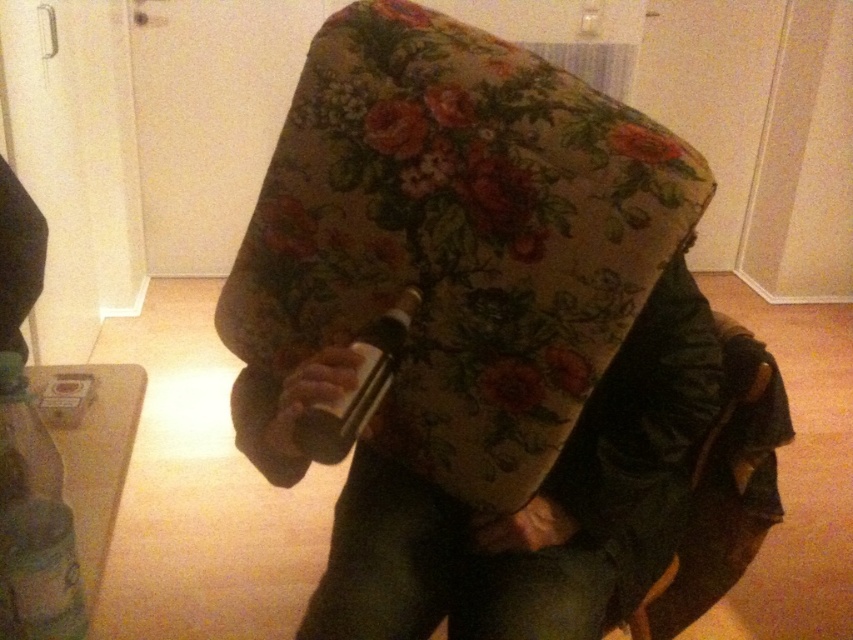
Is floral fabric armchair at center closer to camera compared to translucent plastic bottle at lower left?

No, floral fabric armchair at center is further to the viewer.

Can you confirm if floral fabric armchair at center is bigger than translucent plastic bottle at lower left?

Yes, floral fabric armchair at center is bigger than translucent plastic bottle at lower left.

This screenshot has height=640, width=853. I want to click on floral fabric armchair at center, so click(x=497, y=342).

Which is behind, point (331, 97) or point (368, 396)?

The point (331, 97) is more distant.

Which is behind, point (679, 342) or point (297, 419)?

The point (679, 342) is behind.

This screenshot has width=853, height=640. Identify the location of floral fabric armchair at center. (497, 342).

Can you confirm if translucent plastic bottle at lower left is thinner than matte plastic bottle at center?

Yes, translucent plastic bottle at lower left is thinner than matte plastic bottle at center.

Between translucent plastic bottle at lower left and matte plastic bottle at center, which one has less height?

With less height is matte plastic bottle at center.

Which is in front, point (44, 556) or point (312, 413)?

Point (44, 556)

Identify the location of translucent plastic bottle at lower left. (33, 522).